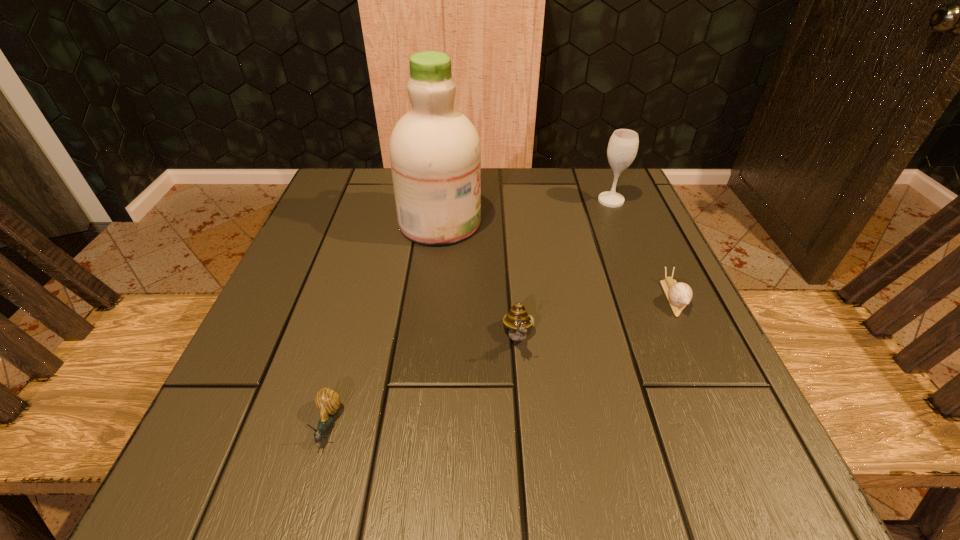
Where is `object identified as the closest to the rightmost escargot`? The height and width of the screenshot is (540, 960). object identified as the closest to the rightmost escargot is located at coordinates click(517, 320).

This screenshot has height=540, width=960. I want to click on escargot object that ranks as the closest to the rightmost escargot, so click(x=517, y=320).

You are a GUI agent. You are given a task and a screenshot of the screen. Output one action in this format:
    pyautogui.click(x=<x>, y=<y>)
    Task: Click on the escargot identified as the second closest to the second tallest object
    The height and width of the screenshot is (540, 960).
    Given the screenshot: What is the action you would take?
    pyautogui.click(x=517, y=320)